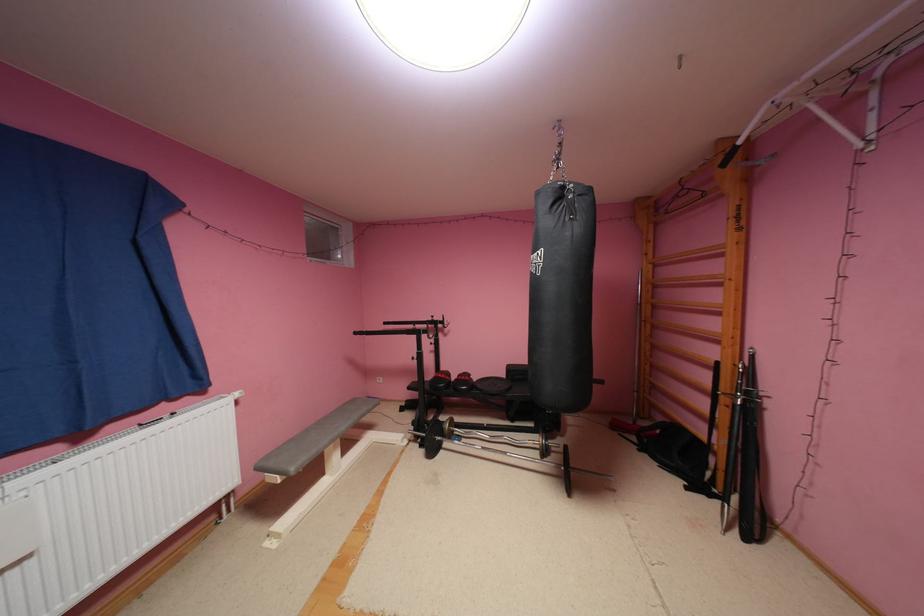
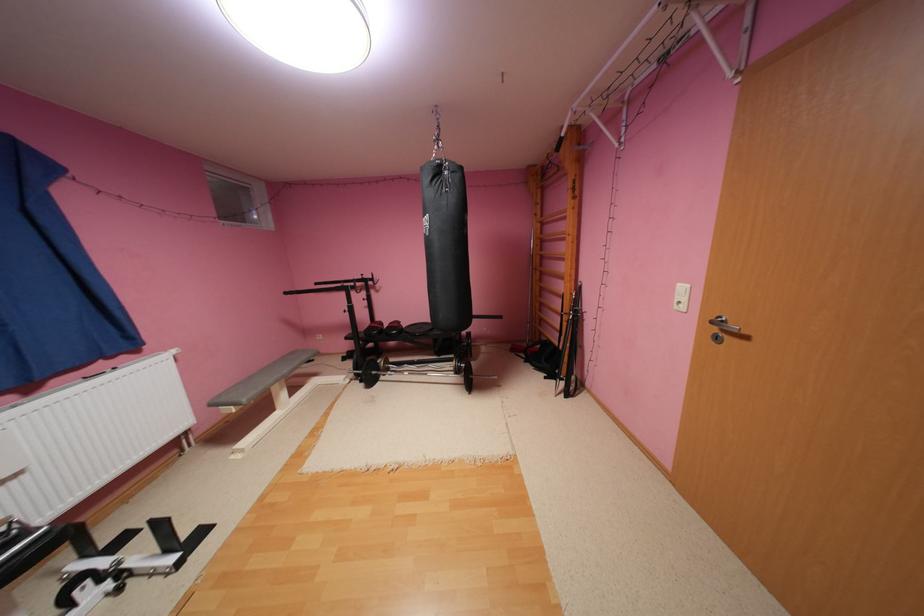
Where in the second image is the point corresponding to point 365,333 from the first image?

(295, 293)